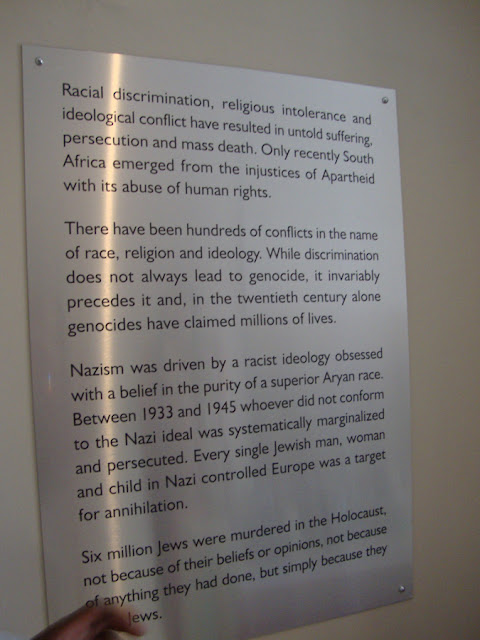
Locate an element on the screen. This screenshot has height=640, width=480. wall background is located at coordinates (434, 356).